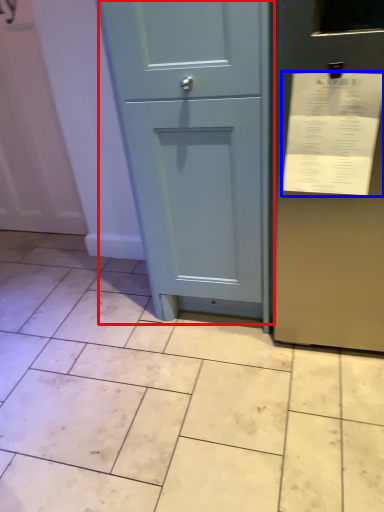
Question: Among these objects, which one is farthest to the camera, door (highlighted by a red box) or receipt (highlighted by a blue box)?

Choices:
 (A) door
 (B) receipt

Answer: (A)